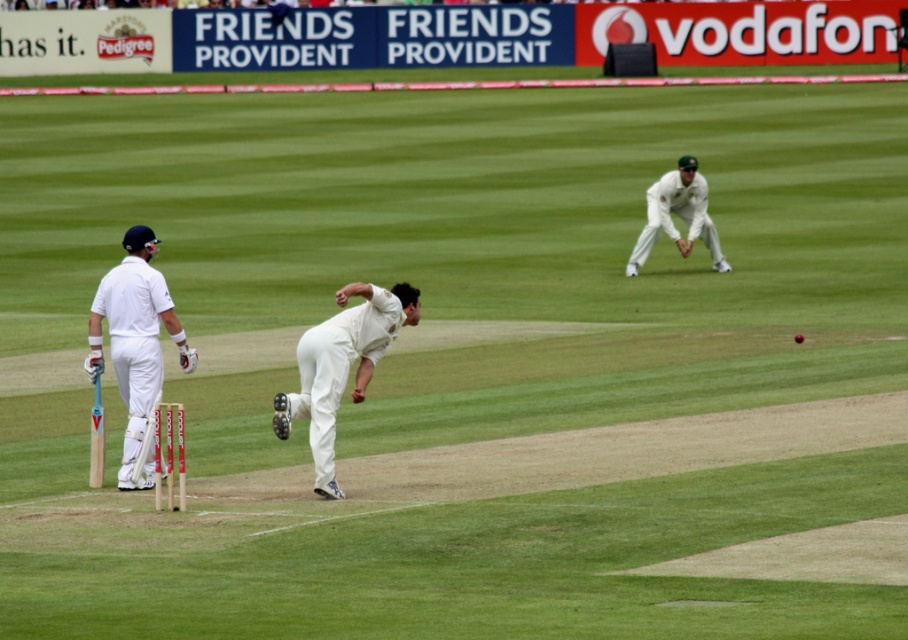
Is white matte cricket bat at left to the left of white cloth glove at upper right from the viewer's perspective?

Correct, you'll find white matte cricket bat at left to the left of white cloth glove at upper right.

Can you confirm if white matte cricket bat at left is shorter than white cloth glove at upper right?

In fact, white matte cricket bat at left may be taller than white cloth glove at upper right.

Which is in front, point (140, 326) or point (713, 256)?

Point (140, 326) is more forward.

Locate an element on the screen. Image resolution: width=908 pixels, height=640 pixels. white matte cricket bat at left is located at coordinates (135, 342).

Which is more to the right, white matte cricket ball at center or white cloth glove at upper right?

white cloth glove at upper right is more to the right.

Does white matte cricket ball at center have a greater height compared to white cloth glove at upper right?

Indeed, white matte cricket ball at center has a greater height compared to white cloth glove at upper right.

Who is more distant from viewer, (293, 412) or (706, 221)?

Point (706, 221)

Where is `white matte cricket ball at center`? This screenshot has width=908, height=640. white matte cricket ball at center is located at coordinates (341, 365).

Can you confirm if white matte cricket bat at left is smaller than white matte cricket ball at center?

Yes.

Is white matte cricket bat at left to the left of white matte cricket ball at center from the viewer's perspective?

Yes, white matte cricket bat at left is to the left of white matte cricket ball at center.

What do you see at coordinates (135, 342) in the screenshot?
I see `white matte cricket bat at left` at bounding box center [135, 342].

This screenshot has width=908, height=640. What are the coordinates of `white matte cricket bat at left` in the screenshot? It's located at (135, 342).